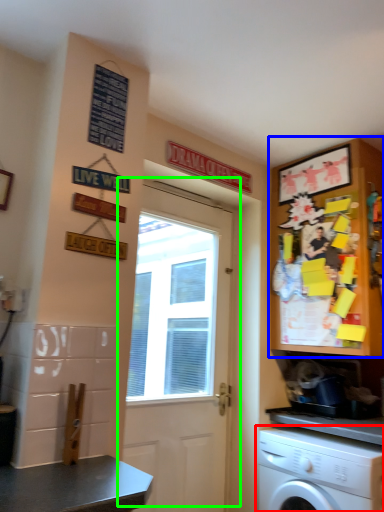
Question: Based on their relative distances, which object is nearer to washing machine (highlighted by a red box)? Choose from cabinetry (highlighted by a blue box) and door (highlighted by a green box).

Choices:
 (A) cabinetry
 (B) door

Answer: (A)